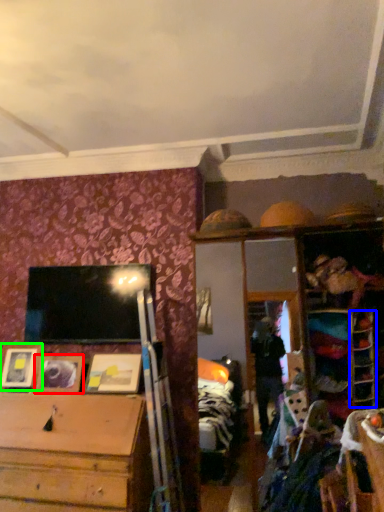
Question: Which is nearer to the picture frame (highlighted by a red box)? shelf (highlighted by a blue box) or picture frame (highlighted by a green box).

Choices:
 (A) shelf
 (B) picture frame

Answer: (B)